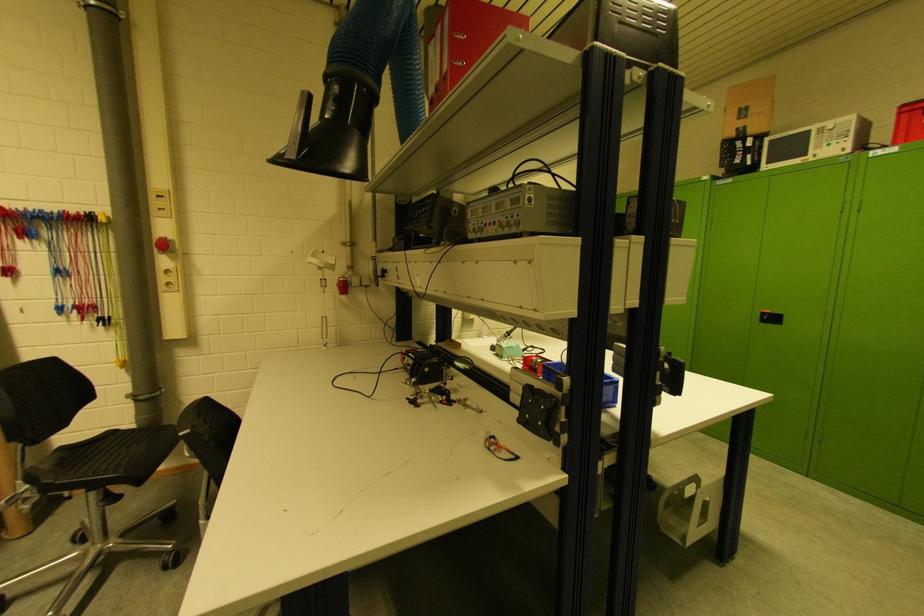
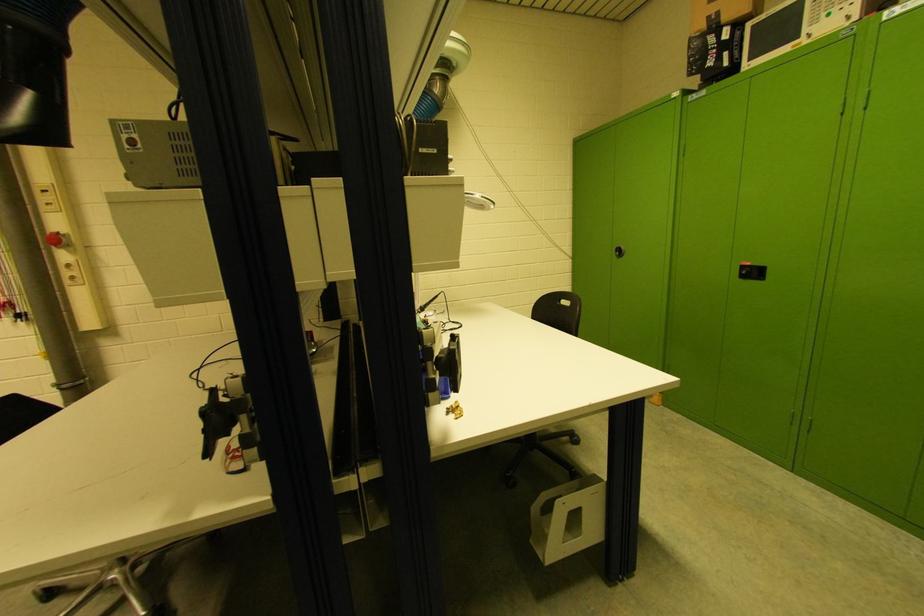
Question: The images are taken continuously from a first-person perspective. In which direction is your viewpoint rotating?

Choices:
 (A) Left
 (B) Right
 (C) Up
 (D) Down

Answer: (A)